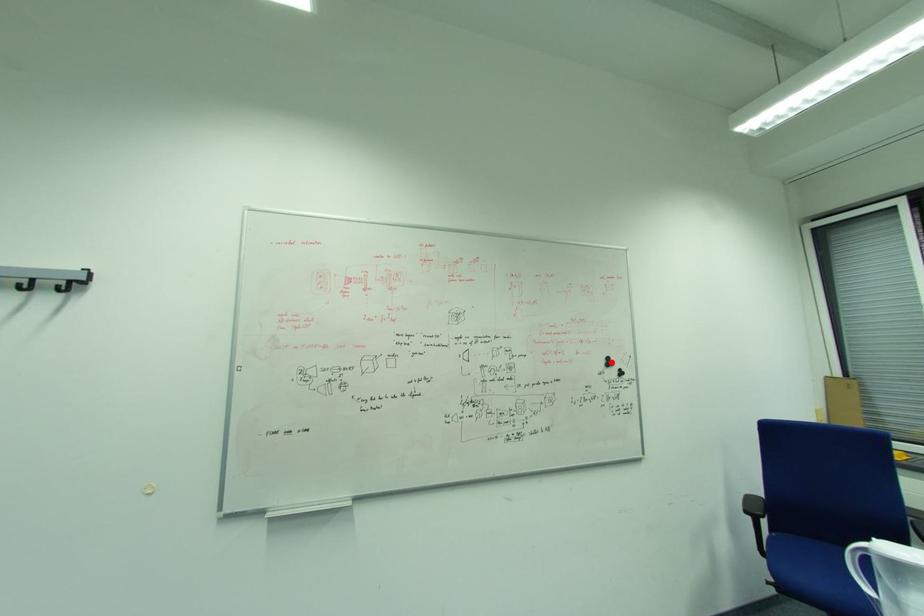
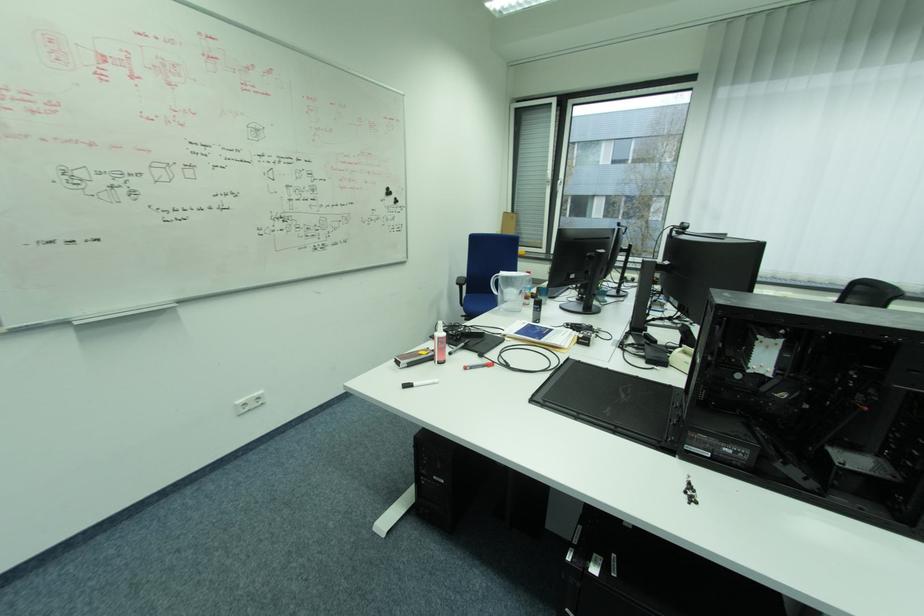
Question: I am providing you with two images of the same scene from different viewpoints. A red point is shown in image1. For the corresponding object point in image2, is it positioned nearer or farther from the camera?

Choices:
 (A) Nearer
 (B) Farther

Answer: (A)